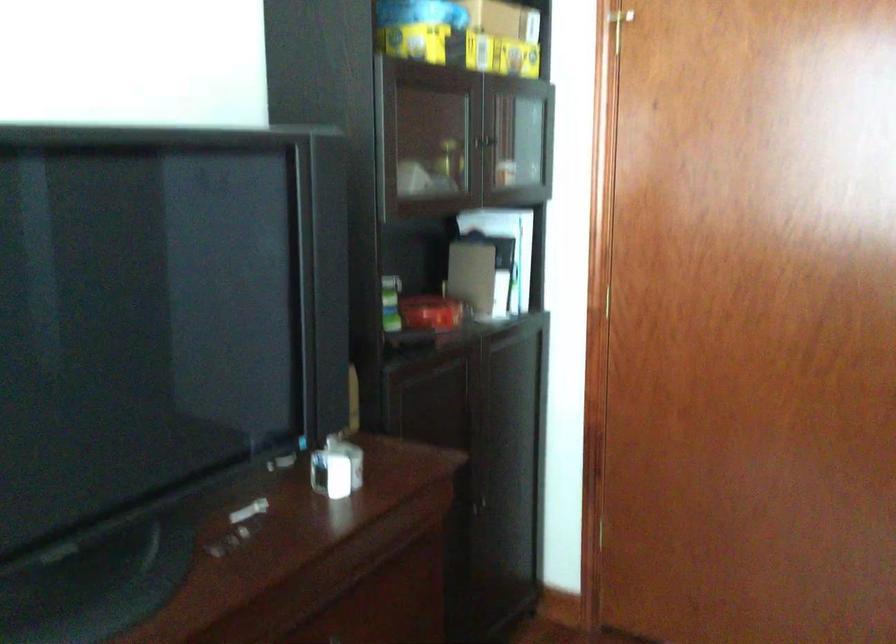
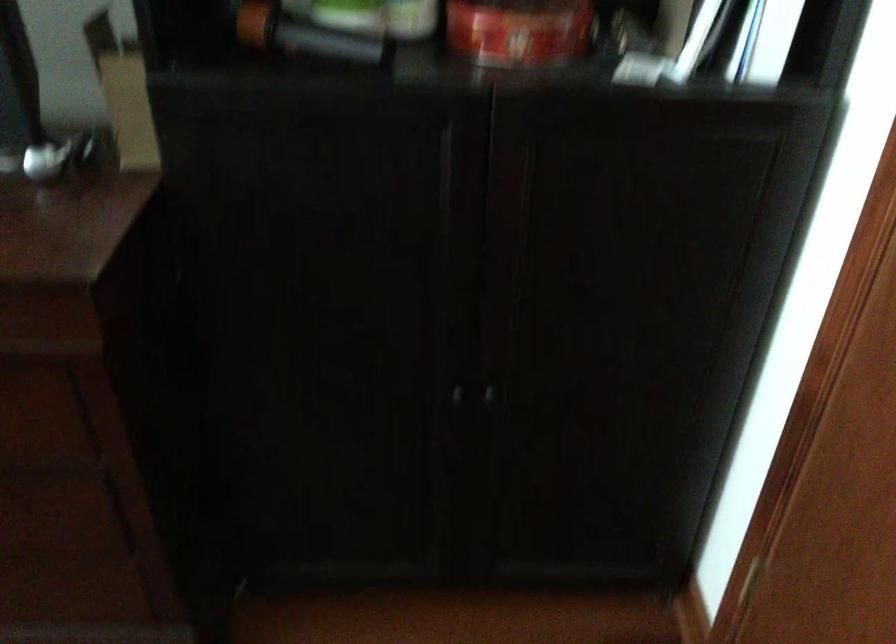
Where in the second image is the point corresponding to pixel 480 511 from the first image?

(487, 395)